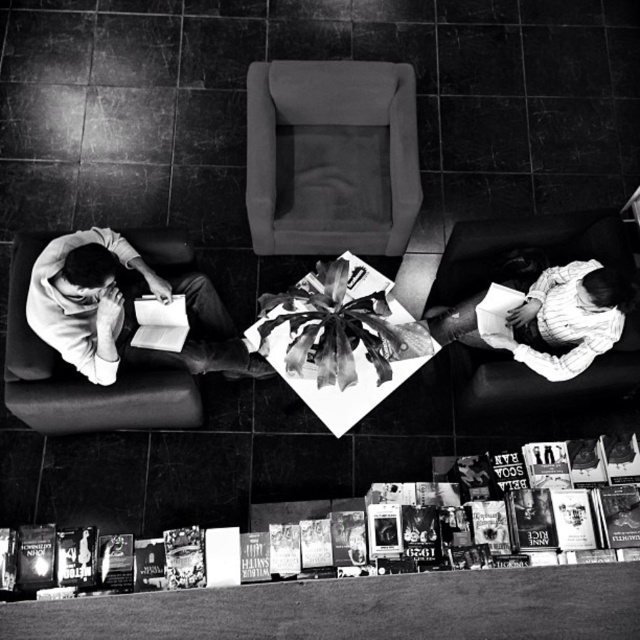
Question: Which of the following is the closest to the observer?

Choices:
 (A) soft gray fabric chair at center
 (B) smooth white shirt at left
 (C) soft fabric couch at lower right

Answer: (B)

Question: Which point appears farthest from the camera in this image?

Choices:
 (A) (180, 289)
 (B) (589, 372)
 (C) (362, 227)

Answer: (C)

Question: Is soft gray fabric chair at center positioned before smooth white shirt at left?

Choices:
 (A) yes
 (B) no

Answer: (B)

Question: Among these points, which one is nearest to the camera?

Choices:
 (A) (461, 275)
 (B) (86, 252)
 (C) (262, 106)

Answer: (B)

Question: Can you confirm if soft gray fabric chair at center is positioned to the right of soft fabric couch at lower right?

Choices:
 (A) yes
 (B) no

Answer: (B)

Question: Does smooth white shirt at left lie behind soft fabric couch at lower right?

Choices:
 (A) yes
 (B) no

Answer: (B)